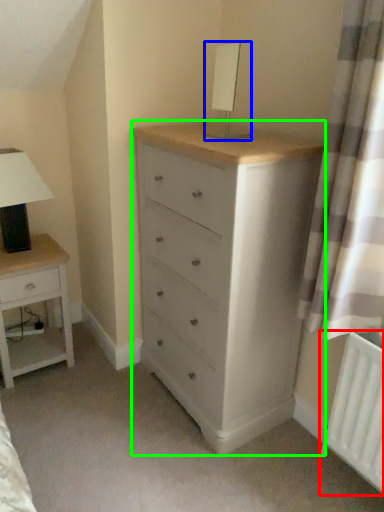
Question: Based on their relative distances, which object is nearer to radiator (highlighted by a red box)? Choose from table lamp (highlighted by a blue box) and chest of drawers (highlighted by a green box).

Choices:
 (A) table lamp
 (B) chest of drawers

Answer: (B)